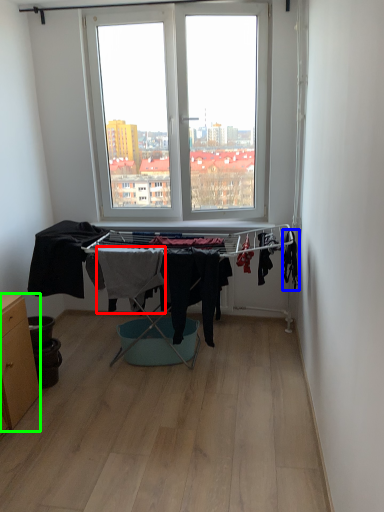
Question: Considering the real-world distances, which object is farthest from clothing (highlighted by a red box)? clothing (highlighted by a blue box) or table (highlighted by a green box)?

Choices:
 (A) clothing
 (B) table

Answer: (A)